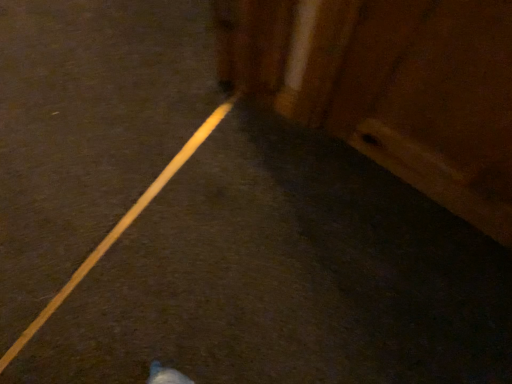
The image size is (512, 384). What do you see at coordinates (122, 226) in the screenshot? I see `yellow matte strip at center` at bounding box center [122, 226].

The width and height of the screenshot is (512, 384). I want to click on yellow matte strip at center, so click(x=122, y=226).

You are a GUI agent. You are given a task and a screenshot of the screen. Output one action in this format:
    pyautogui.click(x=<x>, y=<y>)
    Task: Click on the yellow matte strip at center
    Image resolution: width=512 pixels, height=384 pixels.
    Given the screenshot: What is the action you would take?
    pyautogui.click(x=122, y=226)